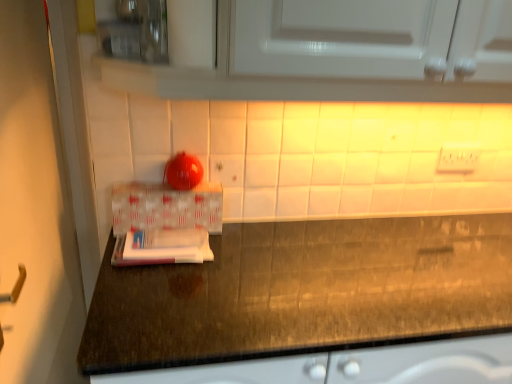
Question: Considering the relative sizes of white woven box at center and white plastic electric outlet at upper center in the image provided, is white woven box at center wider than white plastic electric outlet at upper center?

Choices:
 (A) yes
 (B) no

Answer: (A)

Question: Does white woven box at center appear on the right side of white plastic electric outlet at upper center?

Choices:
 (A) no
 (B) yes

Answer: (A)

Question: Does white woven box at center turn towards white plastic electric outlet at upper center?

Choices:
 (A) no
 (B) yes

Answer: (A)

Question: Is white woven box at center far from white plastic electric outlet at upper center?

Choices:
 (A) no
 (B) yes

Answer: (A)

Question: Can you confirm if white woven box at center is smaller than white plastic electric outlet at upper center?

Choices:
 (A) no
 (B) yes

Answer: (A)

Question: Is white woven box at center at the left side of white plastic electric outlet at upper center?

Choices:
 (A) yes
 (B) no

Answer: (A)

Question: Is white plastic electric outlet at upper center surrounding white woven box at center?

Choices:
 (A) yes
 (B) no

Answer: (B)

Question: Does white plastic electric outlet at upper center appear on the left side of white woven box at center?

Choices:
 (A) yes
 (B) no

Answer: (B)

Question: From the image's perspective, is white plastic electric outlet at upper center over white woven box at center?

Choices:
 (A) no
 (B) yes

Answer: (B)

Question: From a real-world perspective, is white plastic electric outlet at upper center located beneath white woven box at center?

Choices:
 (A) yes
 (B) no

Answer: (B)

Question: Is white plastic electric outlet at upper center behind white woven box at center?

Choices:
 (A) yes
 (B) no

Answer: (A)

Question: From a real-world perspective, is white plastic electric outlet at upper center on white woven box at center?

Choices:
 (A) no
 (B) yes

Answer: (B)

Question: Is white plastic electric outlet at upper center spatially inside white woven box at center, or outside of it?

Choices:
 (A) inside
 (B) outside

Answer: (B)